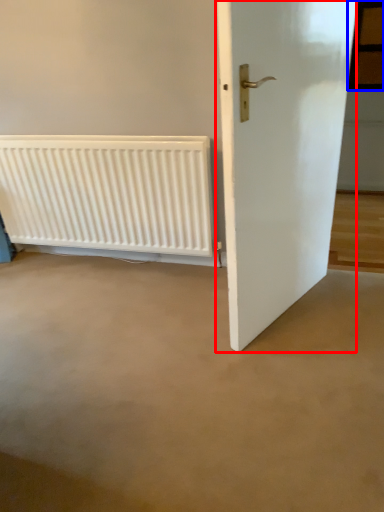
Question: Among these objects, which one is nearest to the camera, door (highlighted by a red box) or window (highlighted by a blue box)?

Choices:
 (A) door
 (B) window

Answer: (A)